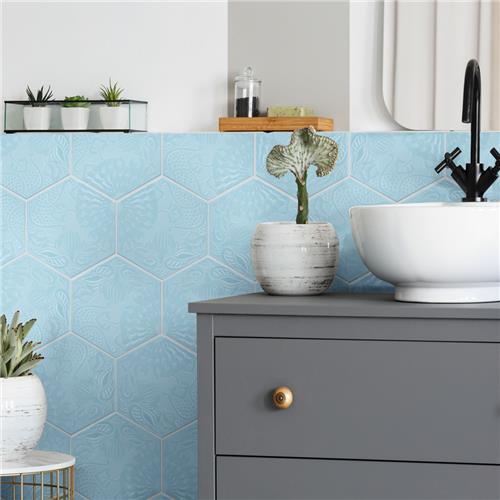
The width and height of the screenshot is (500, 500). I want to click on knob, so click(x=281, y=393).